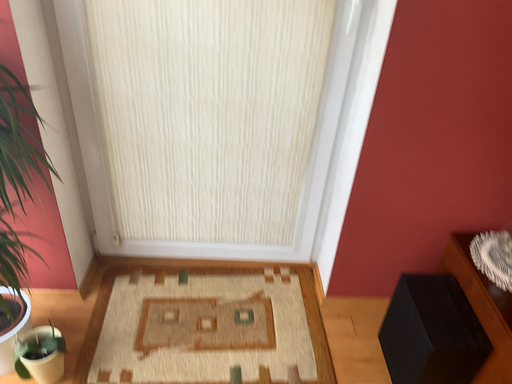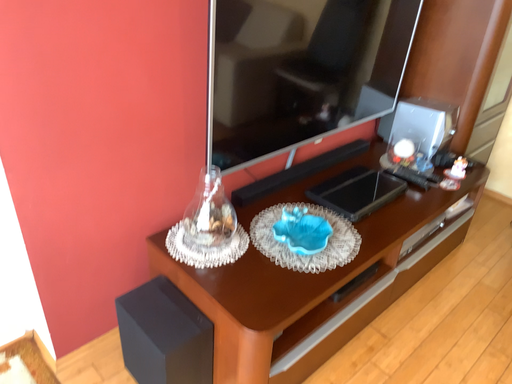
Question: How did the camera likely rotate when shooting the video?

Choices:
 (A) rotated right
 (B) rotated left

Answer: (A)